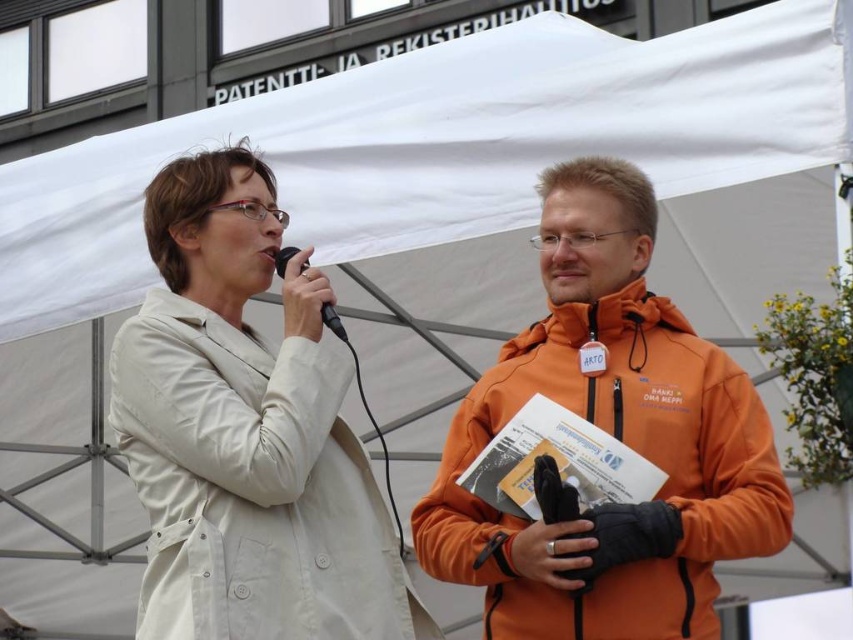
Does matte white coat at left appear on the right side of black plastic microphone at center?

Incorrect, matte white coat at left is not on the right side of black plastic microphone at center.

Which is below, matte white coat at left or black plastic microphone at center?

matte white coat at left is lower down.

The image size is (853, 640). Find the location of `matte white coat at left`. matte white coat at left is located at coordinates (247, 433).

The height and width of the screenshot is (640, 853). Identify the location of matte white coat at left. (247, 433).

Measure the distance between point (148, 454) and camera.

124.18 feet

This screenshot has width=853, height=640. What are the coordinates of `matte white coat at left` in the screenshot? It's located at (247, 433).

Measure the distance from orange fleece jacket at right to black plastic microphone at center.

orange fleece jacket at right and black plastic microphone at center are 33.18 feet apart.

Can you confirm if orange fleece jacket at right is positioned to the left of black plastic microphone at center?

In fact, orange fleece jacket at right is to the right of black plastic microphone at center.

Based on the photo, who is more distant from viewer, (544,285) or (332,314)?

The point (544,285) is more distant.

You are a GUI agent. You are given a task and a screenshot of the screen. Output one action in this format:
    pyautogui.click(x=<x>, y=<y>)
    Task: Click on the orange fleece jacket at right
    The image size is (853, 640).
    Given the screenshot: What is the action you would take?
    pyautogui.click(x=613, y=436)